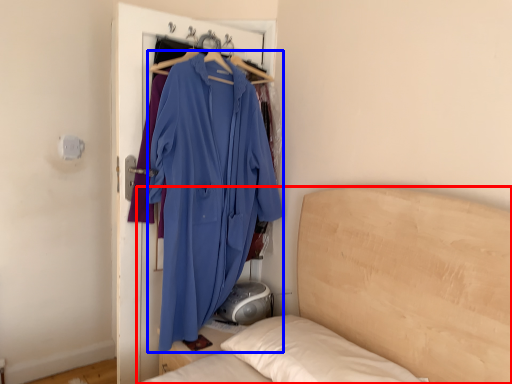
Question: Which object is closer to the camera taking this photo, bed (highlighted by a red box) or fancy dress (highlighted by a blue box)?

Choices:
 (A) bed
 (B) fancy dress

Answer: (A)